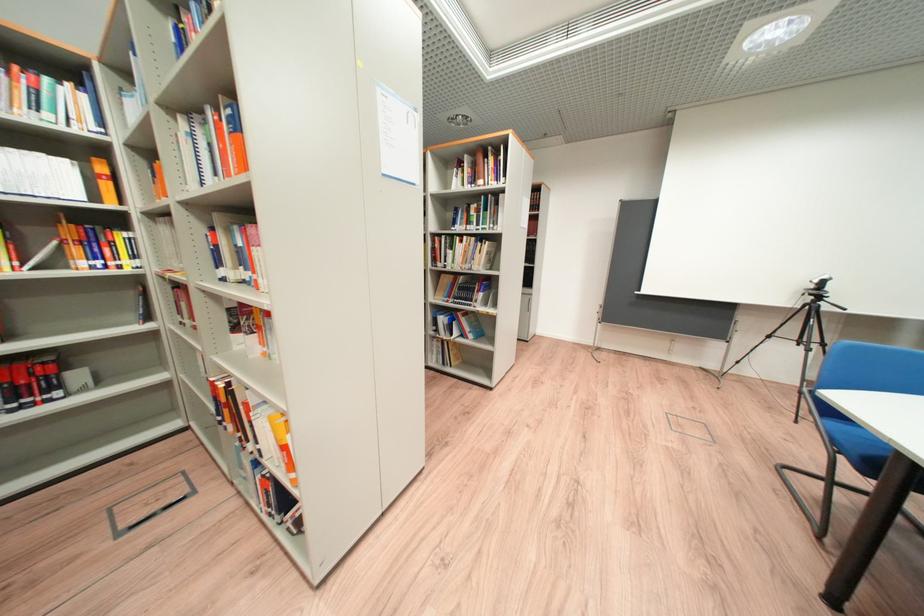
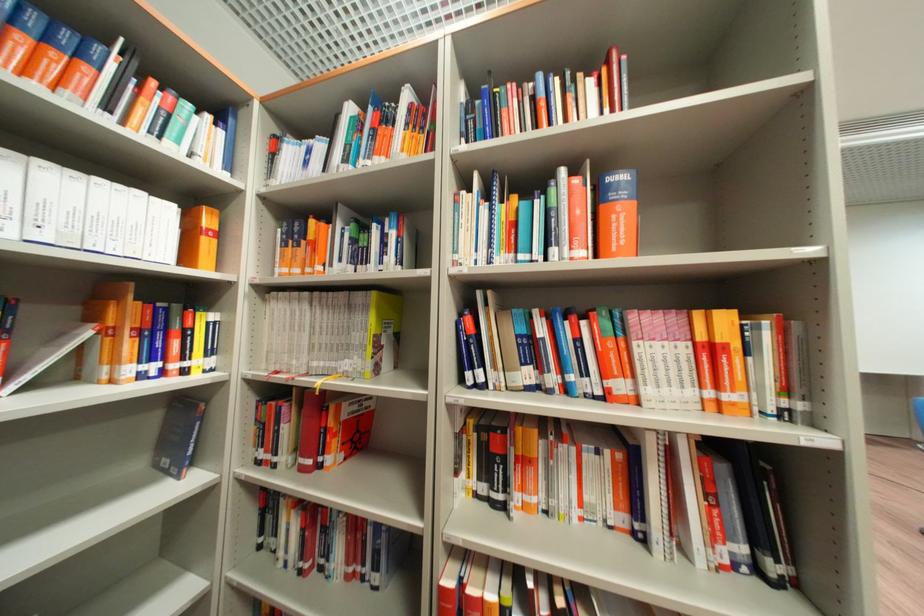
Where in the second image is the point corresponding to [104,198] from the first image?

(198, 260)